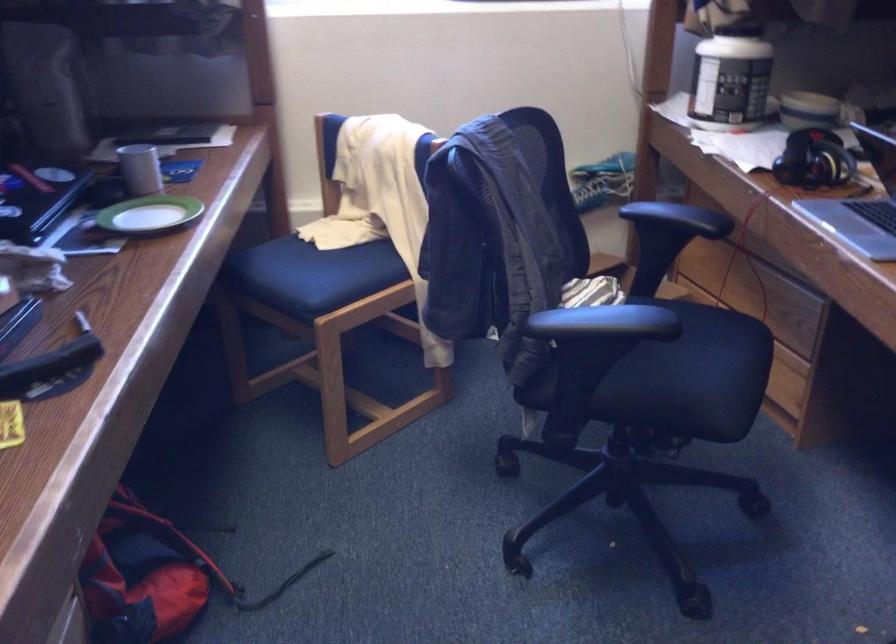
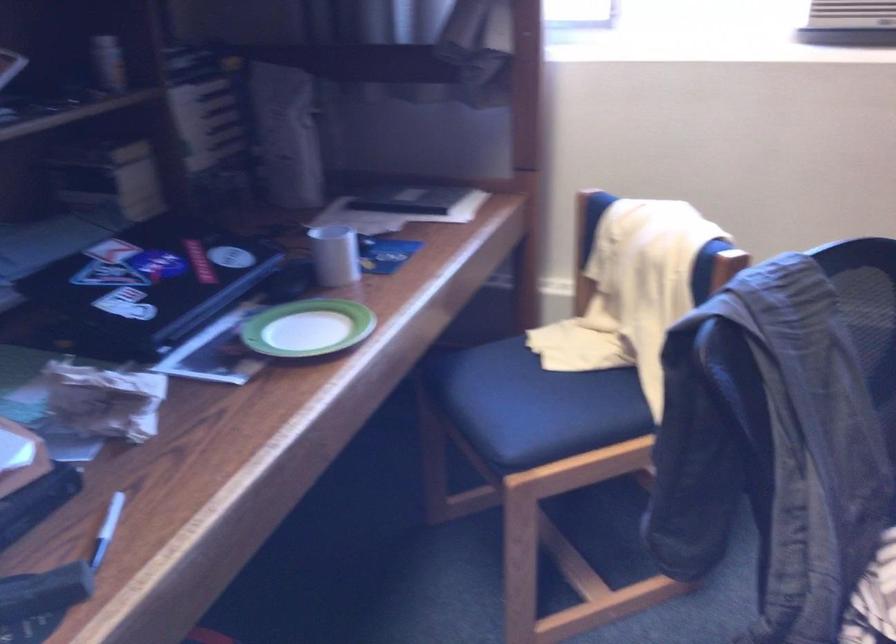
In the second image, find the point that corresponds to point 147,167 in the first image.

(334, 254)